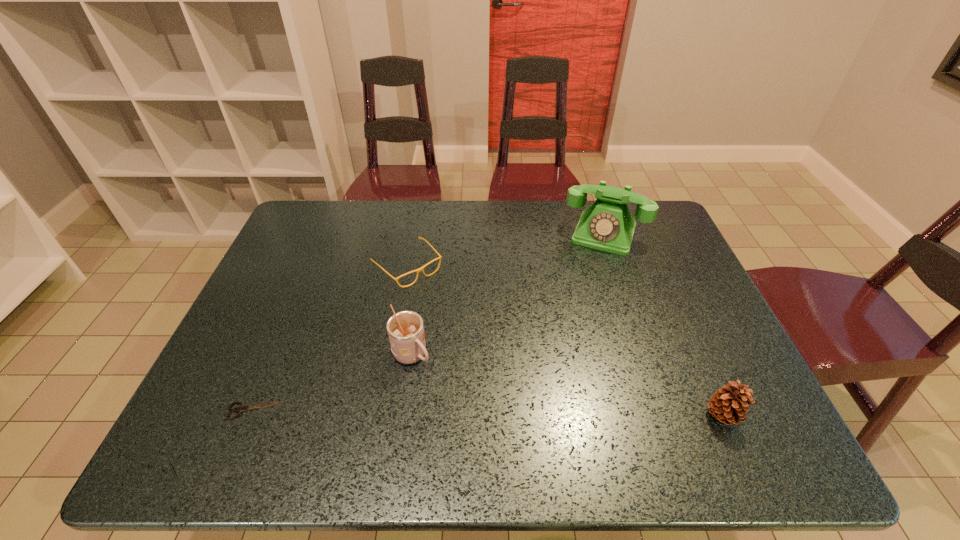
Locate an element on the screen. The height and width of the screenshot is (540, 960). free space at the near right corner of the desktop is located at coordinates (750, 388).

At what (x,y) coordinates should I click in order to perform the action: click on vacant space that's between the third nearest object and the telephone. Please return your answer as a coordinate pair (x, y). This screenshot has width=960, height=540. Looking at the image, I should click on (508, 295).

Identify the location of blank region between the shears and the cup. (333, 383).

In order to click on free space between the cup and the shortest object in this screenshot , I will do `click(333, 383)`.

The width and height of the screenshot is (960, 540). Identify the location of unoccupied area between the fourth tallest object and the tallest object. [x=506, y=250].

At what (x,y) coordinates should I click in order to perform the action: click on empty location between the shortest object and the pinecone. Please return your answer as a coordinate pair (x, y). The image size is (960, 540). Looking at the image, I should click on (488, 413).

You are a GUI agent. You are given a task and a screenshot of the screen. Output one action in this format:
    pyautogui.click(x=<x>, y=<y>)
    Task: Click on the vacant point located between the pinecone and the tallest object
    
    Given the screenshot: What is the action you would take?
    pyautogui.click(x=662, y=325)

The width and height of the screenshot is (960, 540). Identify the location of vacant space that's between the tallest object and the fourth tallest object. (506, 250).

The image size is (960, 540). I want to click on free space between the third tallest object and the leftmost object, so click(488, 413).

Locate an element on the screen. free space that is in between the tallest object and the fourth tallest object is located at coordinates tap(506, 250).